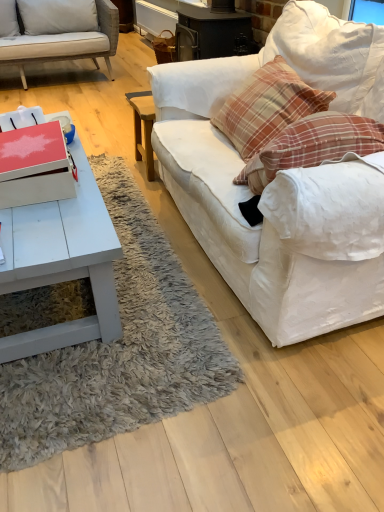
Question: Considering the relative sizes of plaid fabric pillow at upper right and white matte coffee table at lower left in the image provided, is plaid fabric pillow at upper right smaller than white matte coffee table at lower left?

Choices:
 (A) no
 (B) yes

Answer: (B)

Question: From a real-world perspective, does plaid fabric pillow at upper right stand above white matte coffee table at lower left?

Choices:
 (A) yes
 (B) no

Answer: (A)

Question: Can white matte coffee table at lower left be found inside plaid fabric pillow at upper right?

Choices:
 (A) yes
 (B) no

Answer: (B)

Question: From the image's perspective, is plaid fabric pillow at upper right over white matte coffee table at lower left?

Choices:
 (A) no
 (B) yes

Answer: (B)

Question: Is plaid fabric pillow at upper right facing away from white matte coffee table at lower left?

Choices:
 (A) no
 (B) yes

Answer: (A)

Question: Is plaid fabric pillow at upper right closer to camera compared to white matte coffee table at lower left?

Choices:
 (A) yes
 (B) no

Answer: (B)

Question: Could you tell me if white matte coffee table at lower left is turned towards plaid fabric pillow at upper right?

Choices:
 (A) yes
 (B) no

Answer: (B)

Question: Considering the relative sizes of white matte coffee table at lower left and plaid fabric pillow at upper right in the image provided, is white matte coffee table at lower left wider than plaid fabric pillow at upper right?

Choices:
 (A) no
 (B) yes

Answer: (B)

Question: Considering the relative sizes of white matte coffee table at lower left and plaid fabric pillow at upper right in the image provided, is white matte coffee table at lower left shorter than plaid fabric pillow at upper right?

Choices:
 (A) no
 (B) yes

Answer: (A)

Question: From the image's perspective, does white matte coffee table at lower left appear lower than plaid fabric pillow at upper right?

Choices:
 (A) no
 (B) yes

Answer: (B)

Question: From a real-world perspective, is white matte coffee table at lower left physically above plaid fabric pillow at upper right?

Choices:
 (A) no
 (B) yes

Answer: (A)

Question: Is white matte coffee table at lower left thinner than plaid fabric pillow at upper right?

Choices:
 (A) yes
 (B) no

Answer: (B)

Question: Does white fabric couch at right appear on the left side of white matte coffee table at lower left?

Choices:
 (A) yes
 (B) no

Answer: (B)